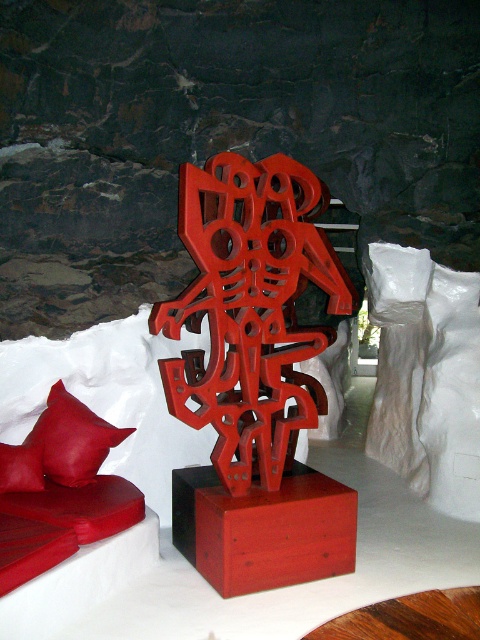
In the scene shown: Can you confirm if matte red sculpture at center is positioned above matte wood table at center?

Yes.

Which is in front, point (224, 301) or point (345, 554)?

Positioned in front is point (224, 301).

Which is behind, point (241, 248) or point (239, 561)?

Positioned behind is point (241, 248).

Where is `matte red sculpture at center`? The height and width of the screenshot is (640, 480). matte red sculpture at center is located at coordinates (251, 310).

Between matte red sculpture at center and matte leather pillow at lower left, which one has more height?

matte red sculpture at center

Can you confirm if matte red sculpture at center is positioned above matte leather pillow at lower left?

Yes, matte red sculpture at center is above matte leather pillow at lower left.

Which is behind, point (216, 168) or point (108, 429)?

Positioned behind is point (108, 429).

Where is `matte red sculpture at center`? This screenshot has width=480, height=640. matte red sculpture at center is located at coordinates (251, 310).

In the scene shown: Is matte leather pillow at lower left below matte red pillow at lower left?

Incorrect, matte leather pillow at lower left is not positioned below matte red pillow at lower left.

Is matte leather pillow at lower left shorter than matte red pillow at lower left?

No.

Who is more distant from viewer, (79, 449) or (12, 483)?

Point (79, 449)

You are a GUI agent. You are given a task and a screenshot of the screen. Output one action in this format:
    pyautogui.click(x=<x>, y=<y>)
    Task: Click on the matte leather pillow at lower left
    
    Given the screenshot: What is the action you would take?
    pyautogui.click(x=72, y=438)